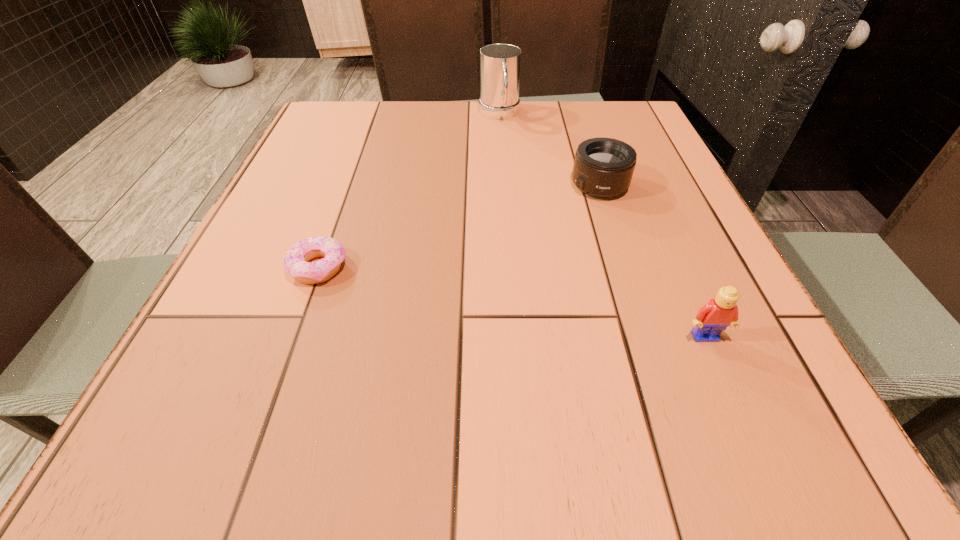
Locate an element on the screen. vacant spot on the desktop that is between the third farthest object and the Lego and is positioned on the side of the third nearest object with brand markings and control switches is located at coordinates (447, 291).

I want to click on free space on the desktop that is between the doughnut and the Lego and is positioned on the side of the mug with the handle, so click(x=550, y=308).